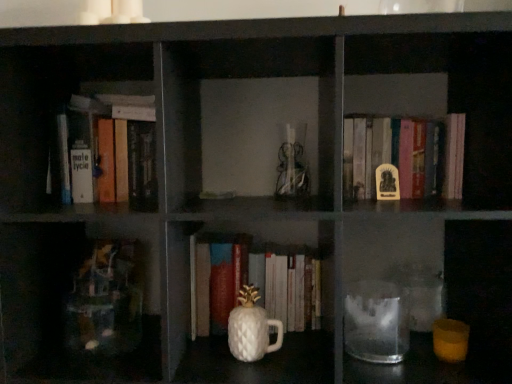
What do you see at coordinates (251, 328) in the screenshot?
I see `white glossy pineapple-shaped cup at center` at bounding box center [251, 328].

Find the location of a particular element. The height and width of the screenshot is (384, 512). hardcover book at upper left, which is the first book in left-to-right order is located at coordinates (114, 149).

The image size is (512, 384). What do you see at coordinates (114, 149) in the screenshot? I see `hardcover book at upper left, arranged as the second book when viewed from the right` at bounding box center [114, 149].

Where is `transparent glass jar at lower center`? The image size is (512, 384). transparent glass jar at lower center is located at coordinates (376, 322).

What do you see at coordinates (394, 159) in the screenshot? The image size is (512, 384). I see `yellow matte statue at center, which is the 1th book from right to left` at bounding box center [394, 159].

Locate an element on the screen. Image resolution: width=512 pixels, height=384 pixels. white glossy pineapple-shaped cup at center is located at coordinates (251, 328).

From a real-world perspective, is yellow matte statue at center, the second book viewed from the left, under hardcover book at upper left, arranged as the second book when viewed from the right?

Yes.

Considering the sizes of objects yellow matte statue at center, the second book viewed from the left, and hardcover book at upper left, arranged as the second book when viewed from the right, in the image provided, who is smaller, yellow matte statue at center, the second book viewed from the left, or hardcover book at upper left, arranged as the second book when viewed from the right,?

yellow matte statue at center, the second book viewed from the left.

The height and width of the screenshot is (384, 512). I want to click on book on the right of hardcover book at upper left, arranged as the second book when viewed from the right, so click(394, 159).

Is hardcover book at upper left, arranged as the second book when viewed from the right, looking in the opposite direction of yellow matte statue at center, the second book viewed from the left?

No, yellow matte statue at center, the second book viewed from the left, is not at the back of hardcover book at upper left, arranged as the second book when viewed from the right.

From the image's perspective, is hardcover book at upper left, arranged as the second book when viewed from the right, below yellow matte statue at center, which is the 1th book from right to left?

Actually, hardcover book at upper left, arranged as the second book when viewed from the right, appears above yellow matte statue at center, which is the 1th book from right to left, in the image.

Is hardcover book at upper left, arranged as the second book when viewed from the right, placed right next to yellow matte statue at center, the second book viewed from the left?

No, hardcover book at upper left, arranged as the second book when viewed from the right, is not in contact with yellow matte statue at center, the second book viewed from the left.

Considering the sizes of objects hardcover book at upper left, arranged as the second book when viewed from the right, and yellow matte statue at center, the second book viewed from the left, in the image provided, who is shorter, hardcover book at upper left, arranged as the second book when viewed from the right, or yellow matte statue at center, the second book viewed from the left,?

Standing shorter between the two is yellow matte statue at center, the second book viewed from the left.

From the picture: From the image's perspective, between yellow matte statue at center, which is the 1th book from right to left, and transparent glass jar at lower center, which one is located above?

yellow matte statue at center, which is the 1th book from right to left, appears higher in the image.

Who is taller, yellow matte statue at center, which is the 1th book from right to left, or transparent glass jar at lower center?

With more height is yellow matte statue at center, which is the 1th book from right to left.

Considering the sizes of yellow matte statue at center, the second book viewed from the left, and transparent glass jar at lower center in the image, is yellow matte statue at center, the second book viewed from the left, wider or thinner than transparent glass jar at lower center?

Clearly, yellow matte statue at center, the second book viewed from the left, has less width compared to transparent glass jar at lower center.

Is yellow matte statue at center, which is the 1th book from right to left, in contact with transparent glass jar at lower center?

No, yellow matte statue at center, which is the 1th book from right to left, is not next to transparent glass jar at lower center.

Can you tell me how much transparent glass jar at lower center and yellow matte statue at center, the second book viewed from the left, differ in facing direction?

0.512 degrees.

Can you confirm if transparent glass jar at lower center is wider than yellow matte statue at center, which is the 1th book from right to left?

Indeed, transparent glass jar at lower center has a greater width compared to yellow matte statue at center, which is the 1th book from right to left.

Is yellow matte statue at center, which is the 1th book from right to left, surrounded by transparent glass jar at lower center?

No.

Looking at the image, does transparent glass jar at lower center seem bigger or smaller compared to yellow matte statue at center, which is the 1th book from right to left?

Clearly, transparent glass jar at lower center is smaller in size than yellow matte statue at center, which is the 1th book from right to left.

From the image's perspective, is hardcover book at upper left, arranged as the second book when viewed from the right, above or below transparent glass jar at lower center?

hardcover book at upper left, arranged as the second book when viewed from the right, is above transparent glass jar at lower center.

Considering the sizes of objects hardcover book at upper left, arranged as the second book when viewed from the right, and transparent glass jar at lower center in the image provided, who is thinner, hardcover book at upper left, arranged as the second book when viewed from the right, or transparent glass jar at lower center?

transparent glass jar at lower center is thinner.

Does point (93, 183) come closer to viewer compared to point (386, 319)?

No, (93, 183) is behind (386, 319).

Which of these two, hardcover book at upper left, which is the first book in left-to-right order, or transparent glass jar at lower center, is smaller?

transparent glass jar at lower center.

Is white glossy pineapple-shaped cup at center turned away from yellow matte statue at center, which is the 1th book from right to left?

No, white glossy pineapple-shaped cup at center is not facing away from yellow matte statue at center, which is the 1th book from right to left.

Could you measure the distance between white glossy pineapple-shaped cup at center and yellow matte statue at center, the second book viewed from the left?

white glossy pineapple-shaped cup at center and yellow matte statue at center, the second book viewed from the left, are 18.99 inches apart.

From the image's perspective, who appears lower, white glossy pineapple-shaped cup at center or yellow matte statue at center, which is the 1th book from right to left?

From the image's view, white glossy pineapple-shaped cup at center is below.

Considering the relative sizes of white glossy pineapple-shaped cup at center and yellow matte statue at center, which is the 1th book from right to left, in the image provided, is white glossy pineapple-shaped cup at center thinner than yellow matte statue at center, which is the 1th book from right to left,?

Correct, the width of white glossy pineapple-shaped cup at center is less than that of yellow matte statue at center, which is the 1th book from right to left.

Does point (388, 341) lie in front of point (153, 147)?

Yes, point (388, 341) is closer to viewer.

Looking at this image, how many degrees apart are the facing directions of transparent glass jar at lower center and hardcover book at upper left, which is the first book in left-to-right order?

The facing directions of transparent glass jar at lower center and hardcover book at upper left, which is the first book in left-to-right order, are 0.000549 degrees apart.

The image size is (512, 384). In order to click on glass jar in front of the hardcover book at upper left, which is the first book in left-to-right order in this screenshot , I will do `click(376, 322)`.

Considering the relative positions of transparent glass jar at lower center and hardcover book at upper left, arranged as the second book when viewed from the right, in the image provided, is transparent glass jar at lower center to the left or to the right of hardcover book at upper left, arranged as the second book when viewed from the right,?

In the image, transparent glass jar at lower center appears on the right side of hardcover book at upper left, arranged as the second book when viewed from the right.

Locate an element on the screen. book in front of the hardcover book at upper left, arranged as the second book when viewed from the right is located at coordinates point(394,159).

Image resolution: width=512 pixels, height=384 pixels. What are the coordinates of `book on the right side of hardcover book at upper left, arranged as the second book when viewed from the right` in the screenshot? It's located at (394, 159).

Which object lies further to the anchor point hardcover book at upper left, which is the first book in left-to-right order, white glossy pineapple-shaped cup at center or transparent glass jar at lower center?

Based on the image, transparent glass jar at lower center appears to be further to hardcover book at upper left, which is the first book in left-to-right order.

Based on their spatial positions, is yellow matte statue at center, which is the 1th book from right to left, or transparent glass jar at lower center further from hardcover book at upper left, which is the first book in left-to-right order?

Among the two, transparent glass jar at lower center is located further to hardcover book at upper left, which is the first book in left-to-right order.

Estimate the real-world distances between objects in this image. Which object is further from transparent glass jar at lower center, white glossy pineapple-shaped cup at center or yellow matte statue at center, the second book viewed from the left?

Among the two, yellow matte statue at center, the second book viewed from the left, is located further to transparent glass jar at lower center.

Which object lies further to the anchor point white glossy pineapple-shaped cup at center, transparent glass jar at lower center or hardcover book at upper left, arranged as the second book when viewed from the right?

hardcover book at upper left, arranged as the second book when viewed from the right, is positioned further to the anchor white glossy pineapple-shaped cup at center.

Looking at the image, which one is located closer to white glossy pineapple-shaped cup at center, yellow matte statue at center, which is the 1th book from right to left, or transparent glass jar at lower center?

Based on the image, transparent glass jar at lower center appears to be nearer to white glossy pineapple-shaped cup at center.

Which object lies further to the anchor point yellow matte statue at center, which is the 1th book from right to left, white glossy pineapple-shaped cup at center or transparent glass jar at lower center?

white glossy pineapple-shaped cup at center is positioned further to the anchor yellow matte statue at center, which is the 1th book from right to left.

Which object lies further to the anchor point yellow matte statue at center, the second book viewed from the left, transparent glass jar at lower center or hardcover book at upper left, which is the first book in left-to-right order?

hardcover book at upper left, which is the first book in left-to-right order, is positioned further to the anchor yellow matte statue at center, the second book viewed from the left.

Based on their spatial positions, is yellow matte statue at center, the second book viewed from the left, or hardcover book at upper left, which is the first book in left-to-right order, further from white glossy pineapple-shaped cup at center?

Based on the image, yellow matte statue at center, the second book viewed from the left, appears to be further to white glossy pineapple-shaped cup at center.

Find the location of a particular element. Image resolution: width=512 pixels, height=384 pixels. glass vase situated between hardcover book at upper left, which is the first book in left-to-right order, and transparent glass jar at lower center from left to right is located at coordinates (251, 328).

Locate an element on the screen. glass vase between hardcover book at upper left, arranged as the second book when viewed from the right, and yellow matte statue at center, the second book viewed from the left, from left to right is located at coordinates (251, 328).

Identify the location of glass jar between yellow matte statue at center, the second book viewed from the left, and white glossy pineapple-shaped cup at center from top to bottom. The image size is (512, 384). (376, 322).

In order to click on glass jar located between hardcover book at upper left, arranged as the second book when viewed from the right, and yellow matte statue at center, which is the 1th book from right to left, in the left-right direction in this screenshot , I will do `click(376, 322)`.